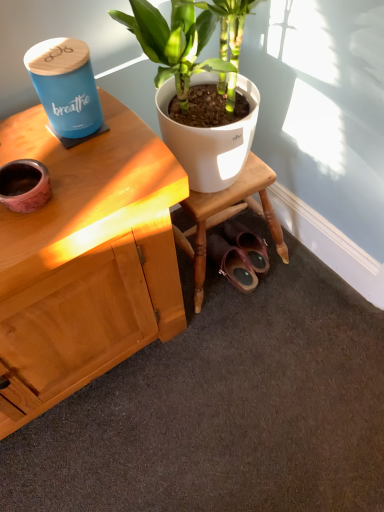
Question: Could you tell me if leather/matte sandals at lower center is turned towards pink marble flowerpot at left?

Choices:
 (A) no
 (B) yes

Answer: (A)

Question: Is leather/matte sandals at lower center turned away from pink marble flowerpot at left?

Choices:
 (A) no
 (B) yes

Answer: (A)

Question: Is leather/matte sandals at lower center at the right side of pink marble flowerpot at left?

Choices:
 (A) yes
 (B) no

Answer: (A)

Question: From the image's perspective, is leather/matte sandals at lower center under pink marble flowerpot at left?

Choices:
 (A) yes
 (B) no

Answer: (A)

Question: Would you consider leather/matte sandals at lower center to be distant from pink marble flowerpot at left?

Choices:
 (A) no
 (B) yes

Answer: (A)

Question: Are leather/matte sandals at lower center and pink marble flowerpot at left making contact?

Choices:
 (A) yes
 (B) no

Answer: (B)

Question: Does pink marble flowerpot at left contain leather/matte sandals at lower center?

Choices:
 (A) no
 (B) yes

Answer: (A)

Question: From the image's perspective, would you say pink marble flowerpot at left is positioned over leather/matte sandals at lower center?

Choices:
 (A) yes
 (B) no

Answer: (A)

Question: Can you confirm if pink marble flowerpot at left is taller than leather/matte sandals at lower center?

Choices:
 (A) yes
 (B) no

Answer: (B)

Question: From a real-world perspective, is pink marble flowerpot at left located higher than leather/matte sandals at lower center?

Choices:
 (A) no
 (B) yes

Answer: (B)

Question: Is pink marble flowerpot at left with leather/matte sandals at lower center?

Choices:
 (A) no
 (B) yes

Answer: (A)

Question: Is pink marble flowerpot at left at the left side of leather/matte sandals at lower center?

Choices:
 (A) no
 (B) yes

Answer: (B)

Question: Is leather/matte sandals at lower center to the left or to the right of pink marble flowerpot at left in the image?

Choices:
 (A) left
 (B) right

Answer: (B)